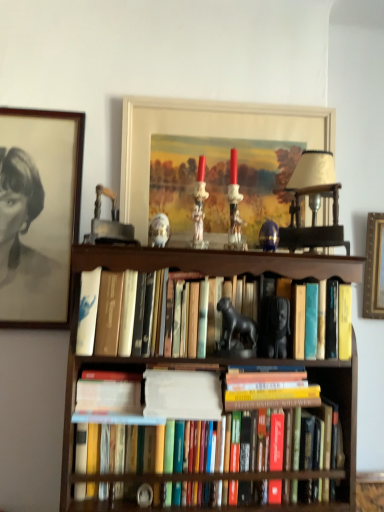
Question: In which direction should I rotate to look at hardcover books at center, arranged as the 1th book when viewed from the top?

Choices:
 (A) left
 (B) right

Answer: (B)

Question: Is hardcover books at center, arranged as the 1th book when viewed from the top, positioned before hardcover book at center?

Choices:
 (A) yes
 (B) no

Answer: (A)

Question: From the image's perspective, would you say hardcover books at center, arranged as the 1th book when viewed from the top, is shown under hardcover book at center?

Choices:
 (A) no
 (B) yes

Answer: (A)

Question: Is hardcover books at center, which is counted as the 4th book, starting from the bottom, bigger than hardcover book at center?

Choices:
 (A) no
 (B) yes

Answer: (B)

Question: Considering the relative sizes of hardcover books at center, which is counted as the 4th book, starting from the bottom, and hardcover book at center in the image provided, is hardcover books at center, which is counted as the 4th book, starting from the bottom, smaller than hardcover book at center?

Choices:
 (A) yes
 (B) no

Answer: (B)

Question: Is hardcover books at center, which is counted as the 4th book, starting from the bottom, positioned with its back to hardcover book at center?

Choices:
 (A) no
 (B) yes

Answer: (A)

Question: Can hardcover book at center be found inside hardcover books at center, which is counted as the 4th book, starting from the bottom?

Choices:
 (A) no
 (B) yes

Answer: (A)

Question: Does hardcover books at center, arranged as the 1th book when viewed from the top, have a greater width compared to black glossy statue at center, which ranks as the first animal in right-to-left order?

Choices:
 (A) yes
 (B) no

Answer: (A)

Question: Does hardcover books at center, arranged as the 1th book when viewed from the top, turn towards black glossy statue at center, which ranks as the first animal in right-to-left order?

Choices:
 (A) yes
 (B) no

Answer: (A)

Question: From the image's perspective, is hardcover books at center, arranged as the 1th book when viewed from the top, over black glossy statue at center, marked as the 1th animal in a bottom-to-top arrangement?

Choices:
 (A) no
 (B) yes

Answer: (B)

Question: Is the surface of hardcover books at center, which is counted as the 4th book, starting from the bottom, in direct contact with black glossy statue at center, which ranks as the first animal in right-to-left order?

Choices:
 (A) no
 (B) yes

Answer: (A)

Question: From a real-world perspective, is hardcover books at center, which is counted as the 4th book, starting from the bottom, physically below black glossy statue at center, which ranks as the first animal in right-to-left order?

Choices:
 (A) yes
 (B) no

Answer: (B)

Question: Can you confirm if hardcover books at center, which is counted as the 4th book, starting from the bottom, is positioned to the left of black glossy statue at center, which ranks as the first animal in right-to-left order?

Choices:
 (A) yes
 (B) no

Answer: (A)

Question: Does matte black portrait at upper left, the 2th picture frame in the right-to-left sequence, touch brown wooden bookcase at center?

Choices:
 (A) no
 (B) yes

Answer: (A)